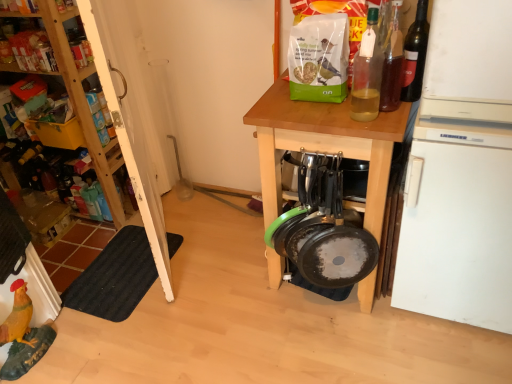
The height and width of the screenshot is (384, 512). I want to click on vacant space to the right of translucent glass bottle at upper right, the 3th bottle in the right-to-left sequence, so click(394, 118).